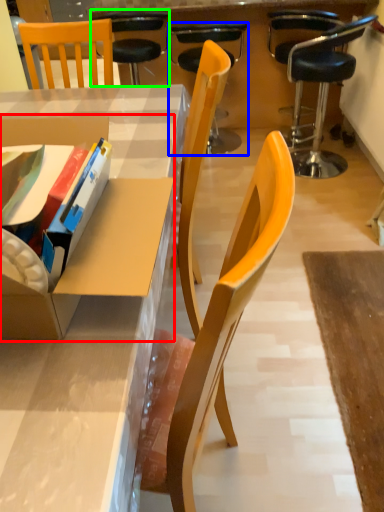
Question: Estimate the real-world distances between objects in this image. Which object is closer to cardboard box (highlighted by a red box), chair (highlighted by a blue box) or chair (highlighted by a green box)?

Choices:
 (A) chair
 (B) chair

Answer: (B)